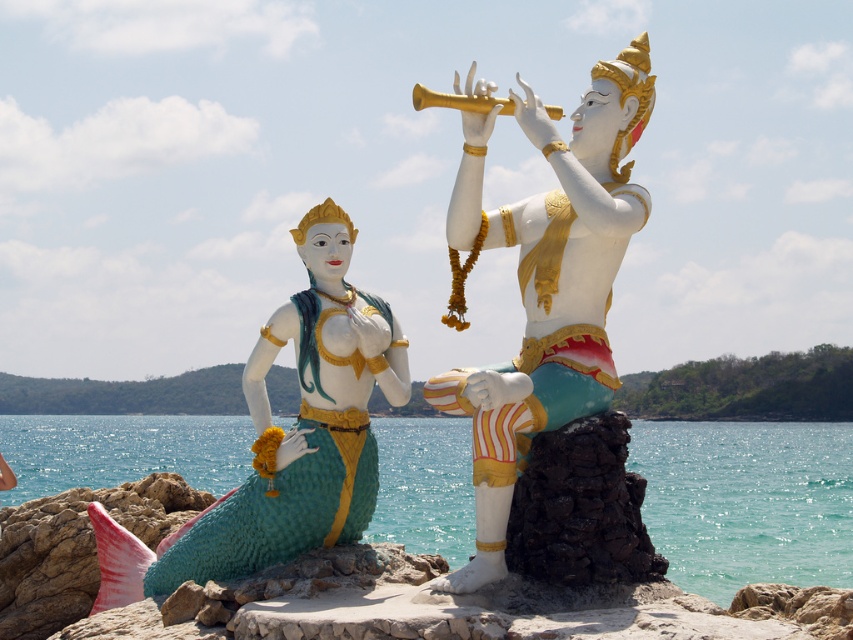
You are a painter standing on the rocky outcrop where the two statues are placed. You want to paint the teal glossy water at lower center and the gold metallic trumpet at upper center. Which object should you look down to paint?

The teal glossy water at lower center is taller than gold metallic trumpet at upper center, so you should look down to paint the teal glossy water at lower center.

You are a tour guide leading a group to the white glossy statue at center and the matte green mermaid statue at left. Your group wants to know if they can comfortably walk between the two statues without feeling cramped. The average shoulder width of a person is 50 cm. Can they walk between them?

The white glossy statue at center and the matte green mermaid statue at left are 8.30 meters apart, which is significantly wider than the average person shoulder width of 50 cm. Therefore, visitors can comfortably walk between them without any issues.